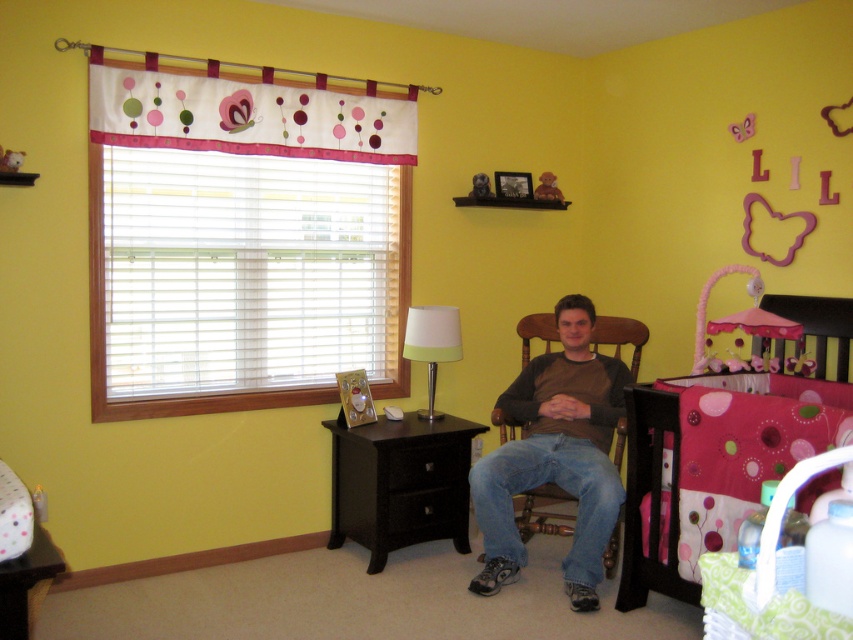
You are standing in the nursery room and want to place a small decoration. You have two points marked in the room at coordinates point (645, 408) and point (430, 372). Which point is closer to you where you can place the decoration?

Point (645, 408) is closer to the camera than point (430, 372), so you can place the decoration at point (645, 408) since it is closer to you.

You are a parent trying to hang a new decoration between the white fabric curtain at upper left and the pink fabric teddy bear at upper center. The decoration requires 1.5 meters of space between the two points. Is there enough space to place it?

The distance between the white fabric curtain at upper left and the pink fabric teddy bear at upper center is 1.43 meters, which is less than the required 1.5 meters. Therefore, there is not enough space to place the decoration between them.

You are a parent entering the nursery and see the brownmaterial sweater at center and the pink fabric teddy bear at upper center. Which object is closer to you?

The brownmaterial sweater at center is closer to you because it is in front of the pink fabric teddy bear at upper center.